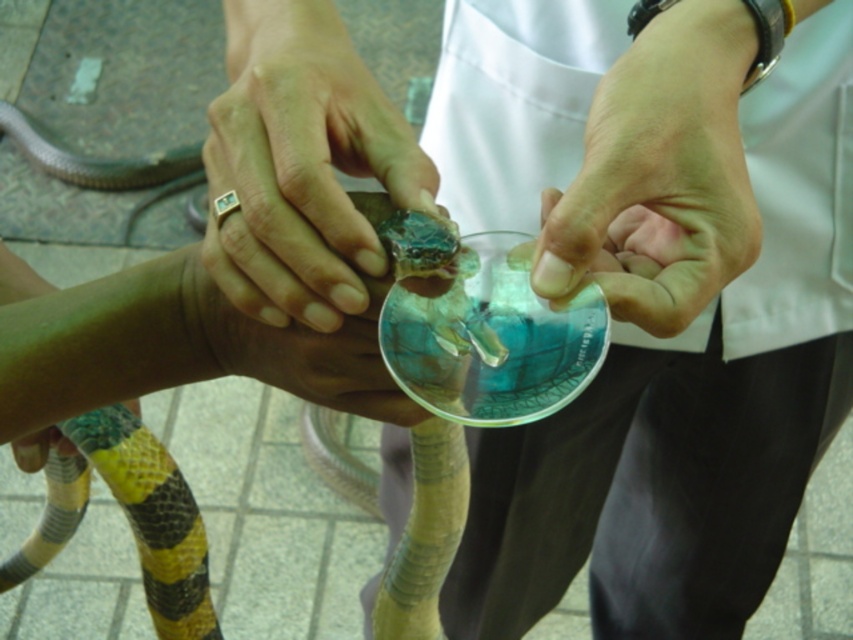
Question: Which point is farther to the camera?

Choices:
 (A) (718, 68)
 (B) (18, 291)
 (C) (221, 145)
 (D) (294, 392)

Answer: (B)

Question: Which of these objects is positioned farthest from the green smooth skin at lower left?

Choices:
 (A) yellow/golden textured snake at center
 (B) smooth skin hand at center
 (C) gold ring at center

Answer: (B)

Question: Where is gold ring at center located in relation to green smooth skin at lower left in the image?

Choices:
 (A) left
 (B) right

Answer: (B)

Question: Which of the following is the farthest from the observer?

Choices:
 (A) (30, 268)
 (B) (376, 305)

Answer: (A)

Question: Does smooth skin hand at center have a greater width compared to yellow/golden textured snake at center?

Choices:
 (A) yes
 (B) no

Answer: (A)

Question: Considering the relative positions of yellow/golden textured snake at center and green smooth skin at lower left in the image provided, where is yellow/golden textured snake at center located with respect to green smooth skin at lower left?

Choices:
 (A) below
 (B) above

Answer: (B)